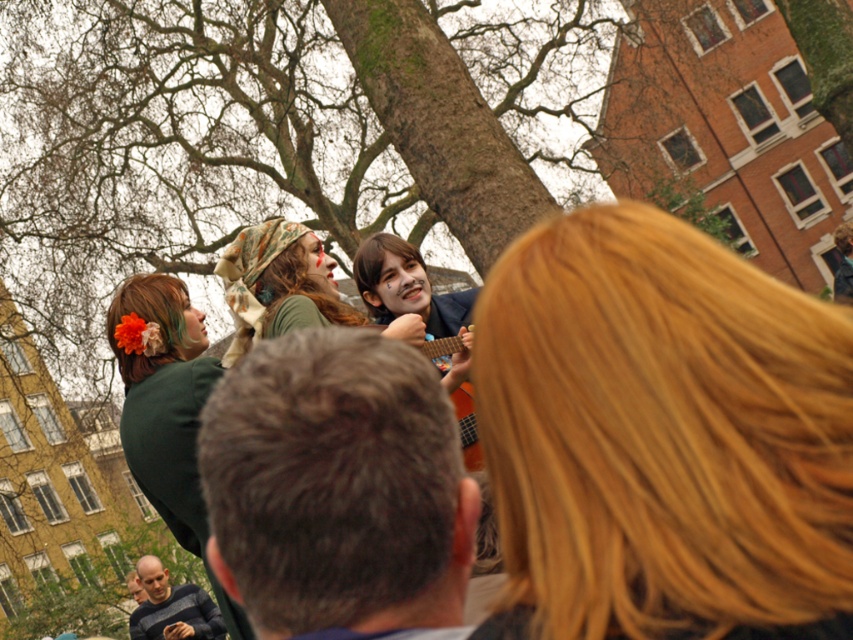
You are standing in the park and want to take a photo of the brown rough bark tree at center. If you are facing the tree, which direction should you move to get closer to it?

Since the brown rough bark tree at center is located at point coordinates, you should move forward towards the center of the scene to get closer to it.

Based on the photo, you are a photographer trying to capture a closeup of the smooth gray sweater at lower left and the smooth bald head at lower left. Since you can only focus on one object at a time, which one would you choose to focus on if you want to ensure it takes up more of the frame?

The smooth bald head at lower left is larger than the smooth gray sweater at lower left, so focusing on the smooth bald head at lower left would ensure it takes up more of the frame.

You are a photographer trying to capture a shot of the blonde hair at center and the smooth gray sweater at lower left. Based on their positions, which object is closer to the camera?

The blonde hair at center is closer to the camera because it is located above the smooth gray sweater at lower left, indicating it is in a higher plane relative to the camera angle.